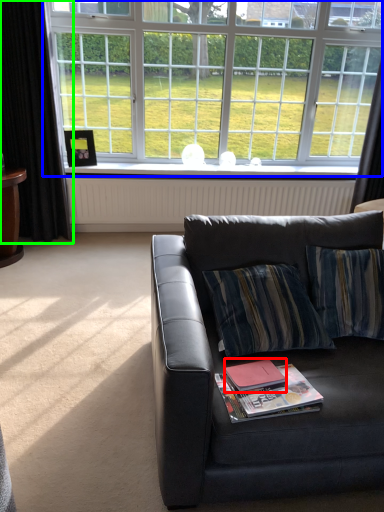
Question: Which object is positioned farthest from paperback book (highlighted by a red box)? Select from window (highlighted by a blue box) and curtain (highlighted by a green box).

Choices:
 (A) window
 (B) curtain

Answer: (A)